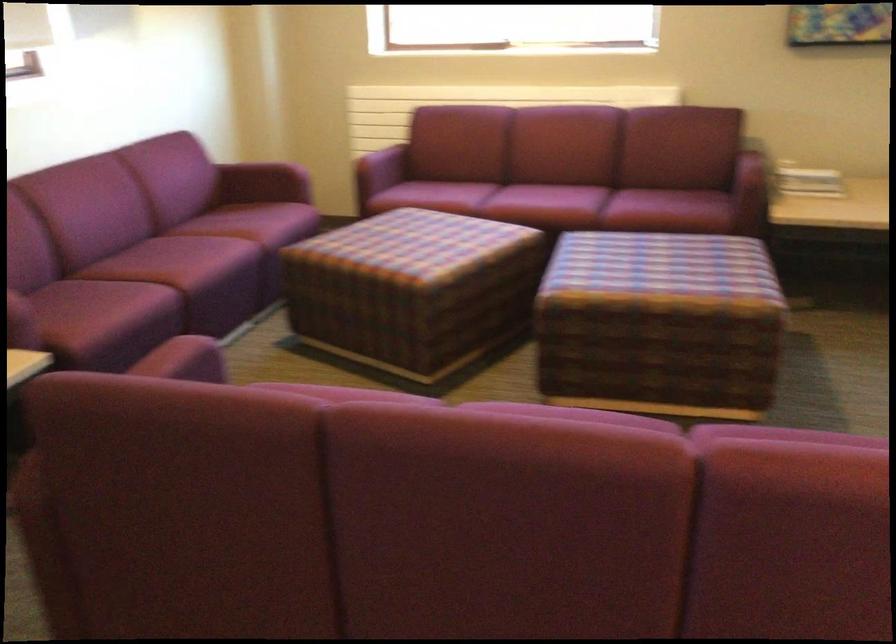
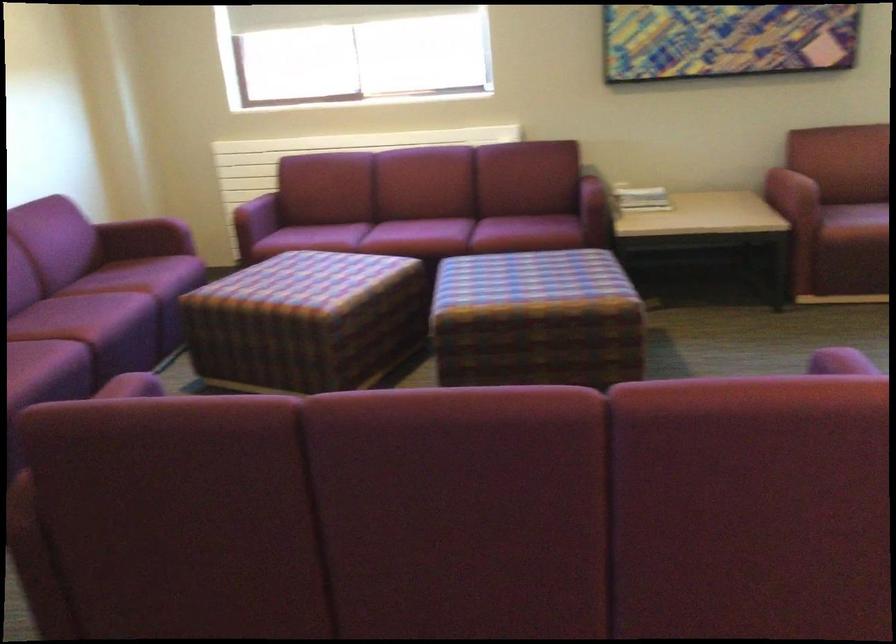
Find the pixel in the second image that matches the point at 754,154 in the first image.

(596, 178)